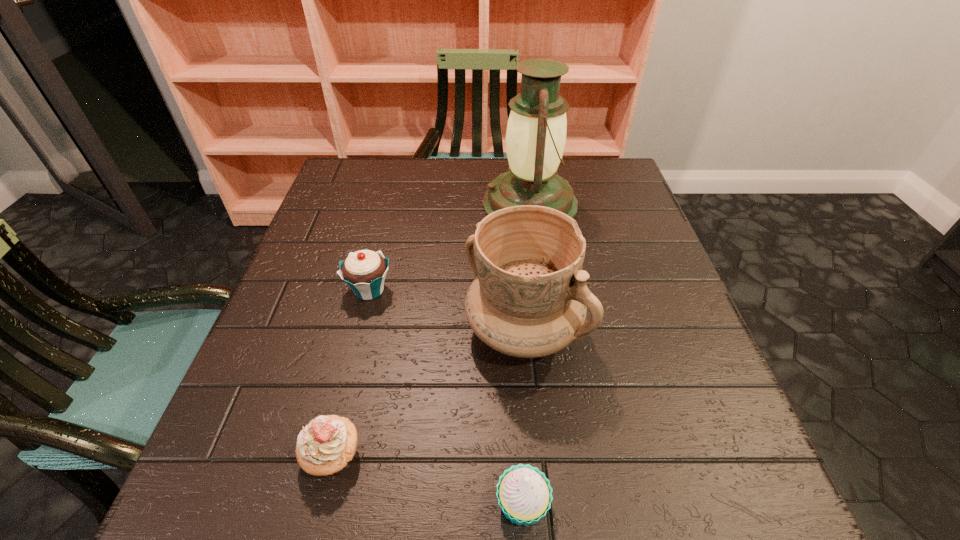
You are a GUI agent. You are given a task and a screenshot of the screen. Output one action in this format:
    pyautogui.click(x=<x>, y=<y>)
    Task: Click on the vacant space located on the back of the farthest cupcake
    The width and height of the screenshot is (960, 540).
    Given the screenshot: What is the action you would take?
    pyautogui.click(x=396, y=180)

At what (x,y) coordinates should I click in order to perform the action: click on free space located 0.330m on the back of the rightmost cupcake. Please return your answer as a coordinate pair (x, y). Image resolution: width=960 pixels, height=540 pixels. Looking at the image, I should click on (510, 307).

Identify the location of object that is at the far edge. (536, 130).

Identify the location of object located in the right edge section of the desktop. The image size is (960, 540). (536, 130).

Find the location of a particular element. This screenshot has width=960, height=540. object that is positioned at the near left corner is located at coordinates (324, 447).

Locate an element on the screen. object present at the far right corner is located at coordinates (536, 130).

Find the location of a particular element. The height and width of the screenshot is (540, 960). free space at the far edge of the desktop is located at coordinates (401, 167).

In order to click on free space at the left edge of the desktop in this screenshot , I will do `click(345, 218)`.

Where is `vacant space at the right edge of the desktop`? The width and height of the screenshot is (960, 540). vacant space at the right edge of the desktop is located at coordinates (598, 223).

Locate an element on the screen. free spot at the far left corner of the desktop is located at coordinates (392, 172).